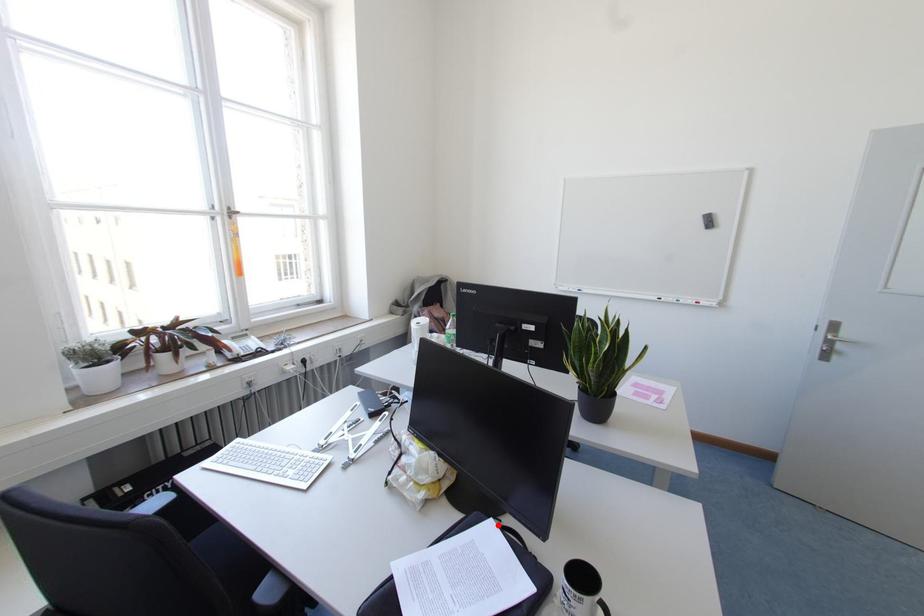
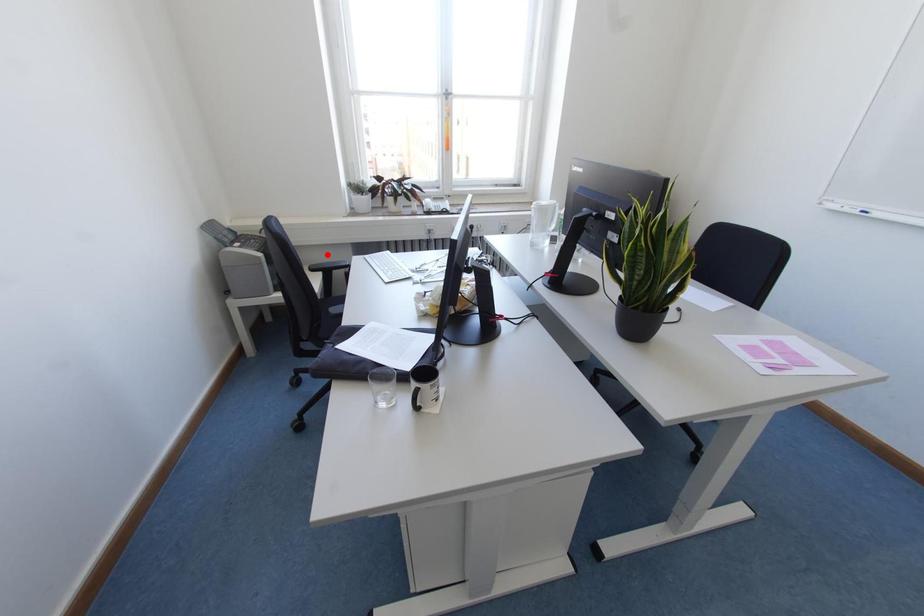
I am providing you with two images of the same scene from different viewpoints. A red point is marked on the first image and another point is marked on the second image. Does the point marked in image1 correspond to the same location as the one in image2?

No